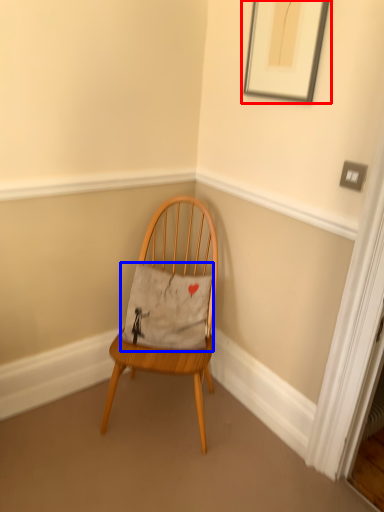
Question: Which point is closer to the camera, picture frame (highlighted by a red box) or pillow (highlighted by a blue box)?

Choices:
 (A) picture frame
 (B) pillow

Answer: (A)